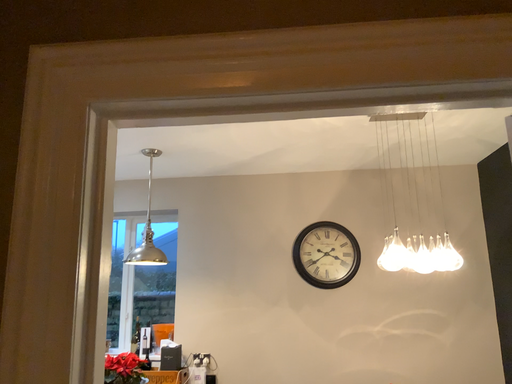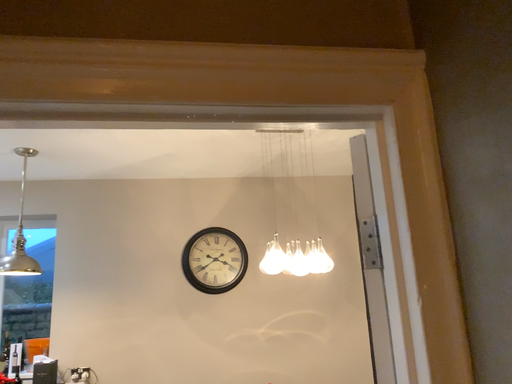
Question: How did the camera likely rotate when shooting the video?

Choices:
 (A) rotated left
 (B) rotated right

Answer: (B)